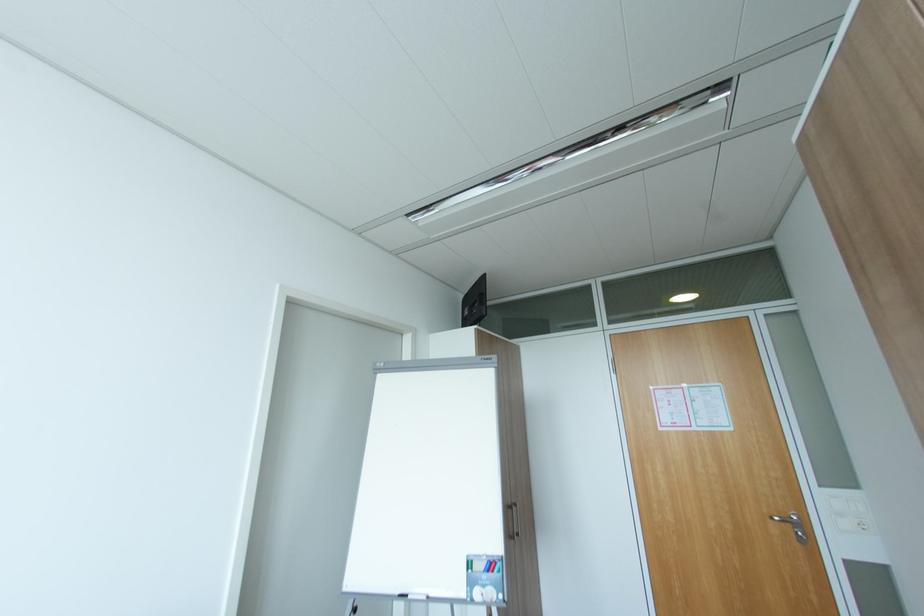
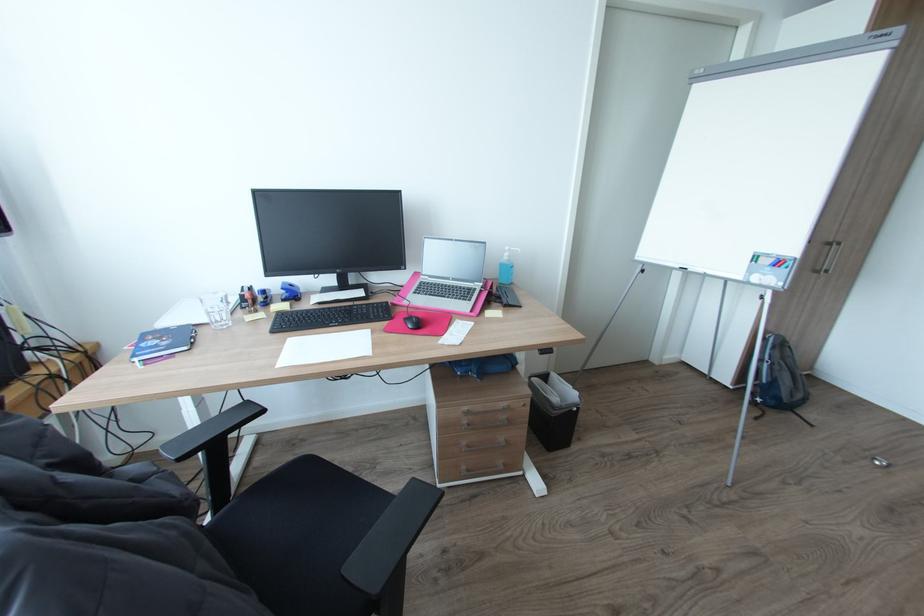
The first image is from the beginning of the video and the second image is from the end. How did the camera likely rotate when shooting the video?

The rotation direction of the camera is left-down.